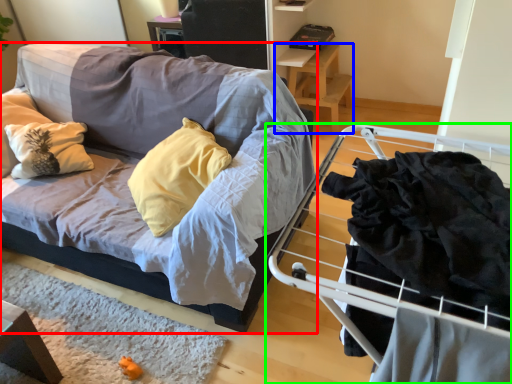
Question: Based on their relative distances, which object is farther from studio couch (highlighted by a red box)? Choose from table (highlighted by a blue box) and furniture (highlighted by a green box).

Choices:
 (A) table
 (B) furniture

Answer: (A)